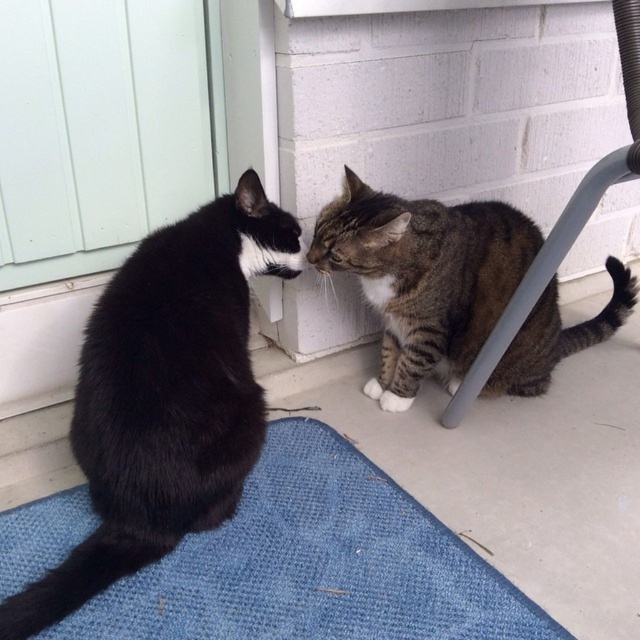
Question: Is blue textured mat at lower center above black fur cat at left?

Choices:
 (A) no
 (B) yes

Answer: (A)

Question: Can you confirm if blue textured mat at lower center is smaller than tabby fur cat at lower center?

Choices:
 (A) yes
 (B) no

Answer: (A)

Question: Which object is farther from the camera taking this photo?

Choices:
 (A) tabby fur cat at lower center
 (B) black fur cat at left

Answer: (A)

Question: Is white wood screen door at upper left behind tabby fur cat at lower center?

Choices:
 (A) yes
 (B) no

Answer: (B)

Question: Among these points, which one is nearest to the camera?

Choices:
 (A) (493, 602)
 (B) (353, 200)
 (C) (88, 358)
 (D) (186, 150)

Answer: (A)

Question: Among these points, which one is farthest from the camera?

Choices:
 (A) (488, 288)
 (B) (195, 392)

Answer: (A)